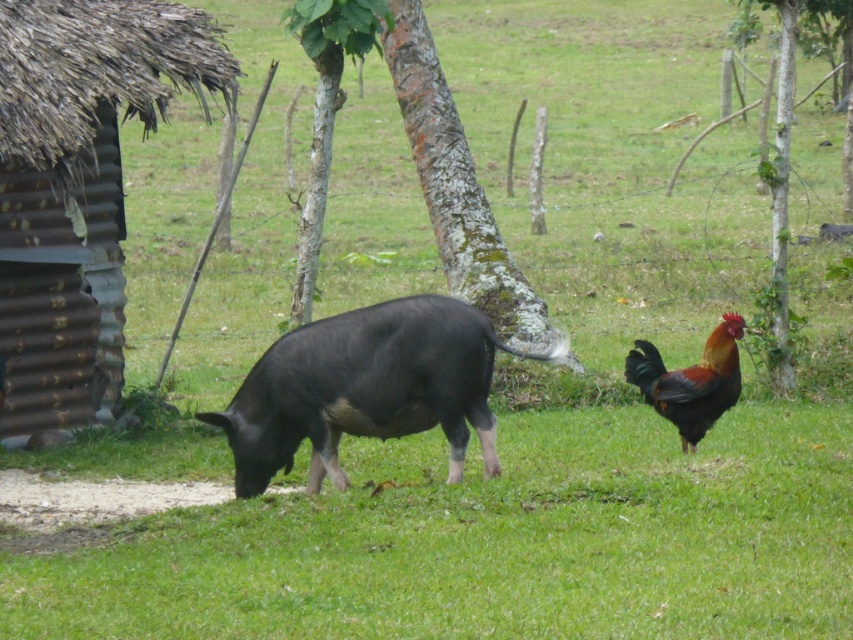
Question: Which object appears closest to the camera in this image?

Choices:
 (A) rusty corrugated hut at left
 (B) black matte pig at center
 (C) green bark tree at center

Answer: (B)

Question: Which object appears farthest from the camera in this image?

Choices:
 (A) green bark tree at right
 (B) shiny brown rooster at right
 (C) black matte pig at center

Answer: (A)

Question: Which object is positioned farthest from the rusty corrugated hut at left?

Choices:
 (A) green bark tree at right
 (B) green rough bark tree at center
 (C) shiny brown rooster at right

Answer: (A)

Question: Observing the image, what is the correct spatial positioning of rusty corrugated hut at left in reference to green rough bark tree at center?

Choices:
 (A) left
 (B) right

Answer: (A)

Question: Observing the image, what is the correct spatial positioning of black matte pig at center in reference to green bark tree at center?

Choices:
 (A) below
 (B) above

Answer: (A)

Question: Does green bark tree at center have a greater width compared to shiny brown rooster at right?

Choices:
 (A) no
 (B) yes

Answer: (B)